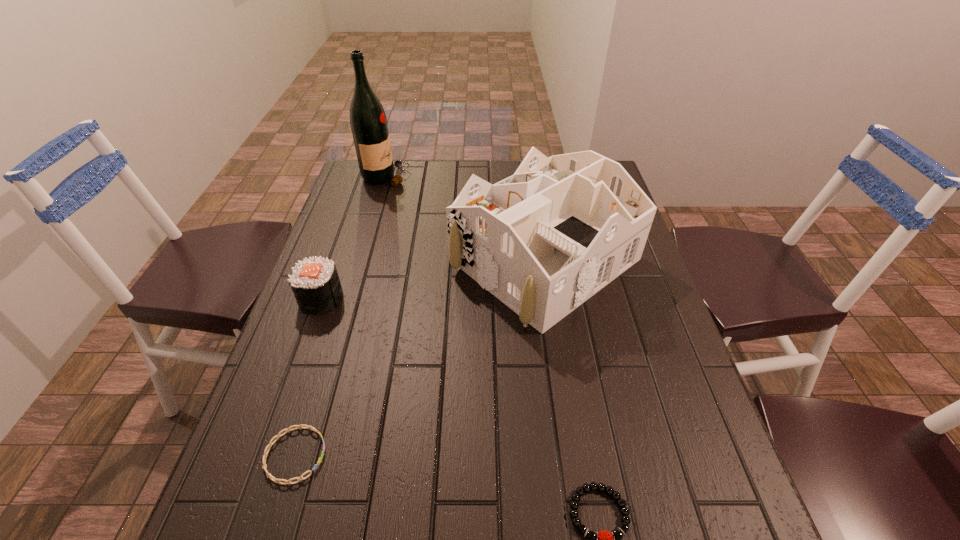
You are a GUI agent. You are given a task and a screenshot of the screen. Output one action in this format:
    pyautogui.click(x=<x>, y=<y>)
    Task: Click on the wine bottle
    
    Given the screenshot: What is the action you would take?
    pyautogui.click(x=368, y=121)

At what (x,y) coordinates should I click in order to perform the action: click on the tallest object. Please return your answer as a coordinate pair (x, y). Image resolution: width=960 pixels, height=540 pixels. Looking at the image, I should click on (368, 121).

In order to click on dollhouse in this screenshot , I will do `click(543, 241)`.

I want to click on the third shortest object, so click(x=315, y=283).

Where is `the left bracelet`? the left bracelet is located at coordinates (278, 435).

Locate an element on the screen. Image resolution: width=960 pixels, height=540 pixels. vacant space located 0.180m on the surface of the tallest object is located at coordinates (460, 177).

Locate an element on the screen. This screenshot has height=540, width=960. vacant space located on the left of the fourth shortest object is located at coordinates (392, 260).

Image resolution: width=960 pixels, height=540 pixels. I want to click on free space located on the front of the third shortest object, so click(x=266, y=456).

This screenshot has height=540, width=960. In order to click on blank area located 0.250m on the surface of the left bracelet showing star-shaped elements in this screenshot , I will do `click(458, 455)`.

Find the location of a particular element. The image size is (960, 540). object present at the far edge is located at coordinates (368, 121).